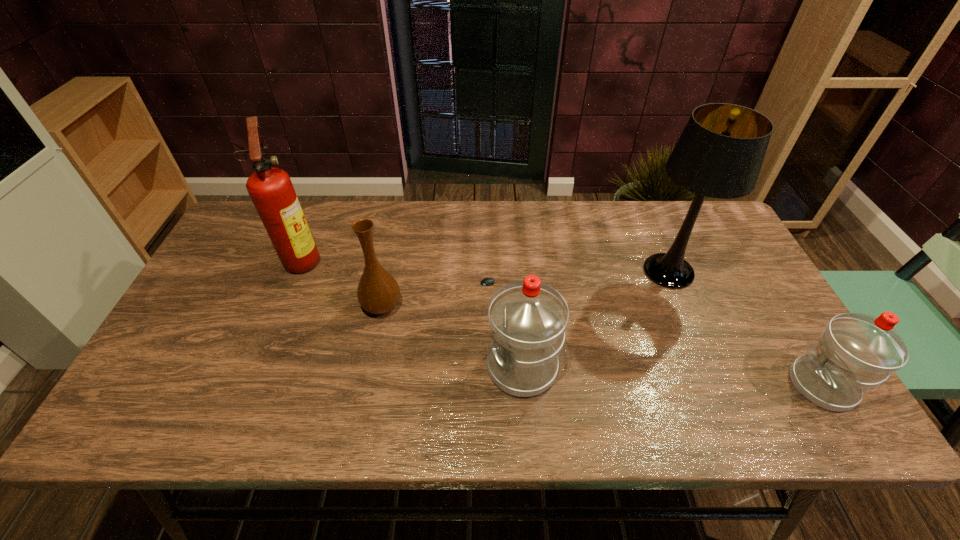
At what (x,y) coordinates should I click in order to perform the action: click on vacant area in the image that satisfies the following two spatial constraints: 1. on the back side of the table lamp; 2. on the right side of the shortest object. Please return your answer as a coordinate pair (x, y). The height and width of the screenshot is (540, 960). Looking at the image, I should click on (496, 271).

Locate an element on the screen. This screenshot has height=540, width=960. vacant region that satisfies the following two spatial constraints: 1. on the front-facing side of the fire extinguisher; 2. on the left side of the mouse is located at coordinates (293, 283).